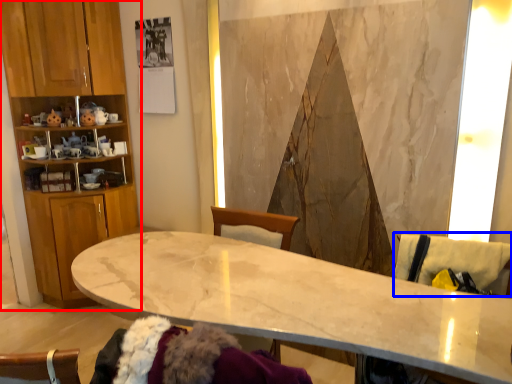
Question: Which object is closer to the camera taking this photo, cabinetry (highlighted by a red box) or swivel chair (highlighted by a blue box)?

Choices:
 (A) cabinetry
 (B) swivel chair

Answer: (B)